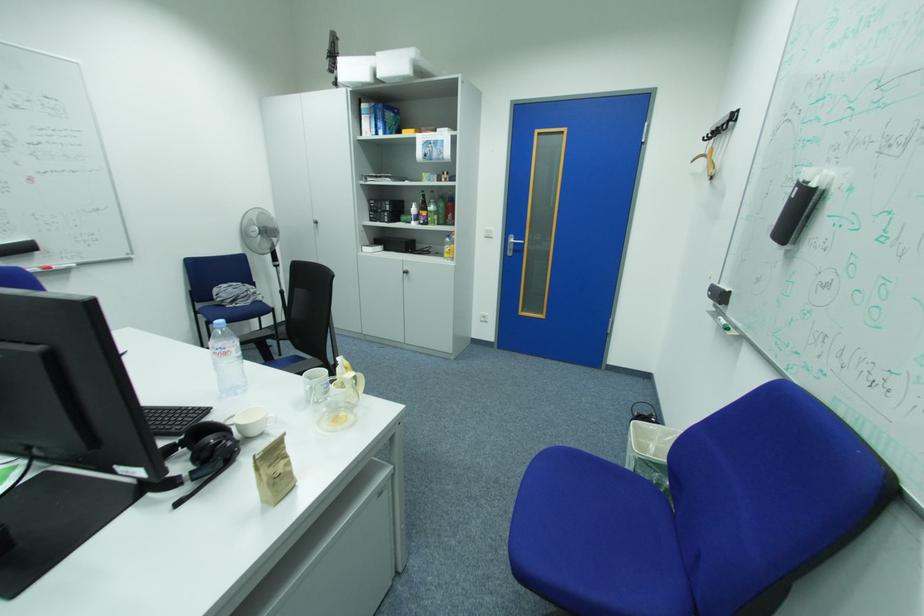
The image size is (924, 616). What do you see at coordinates (512, 244) in the screenshot?
I see `the silver door handle` at bounding box center [512, 244].